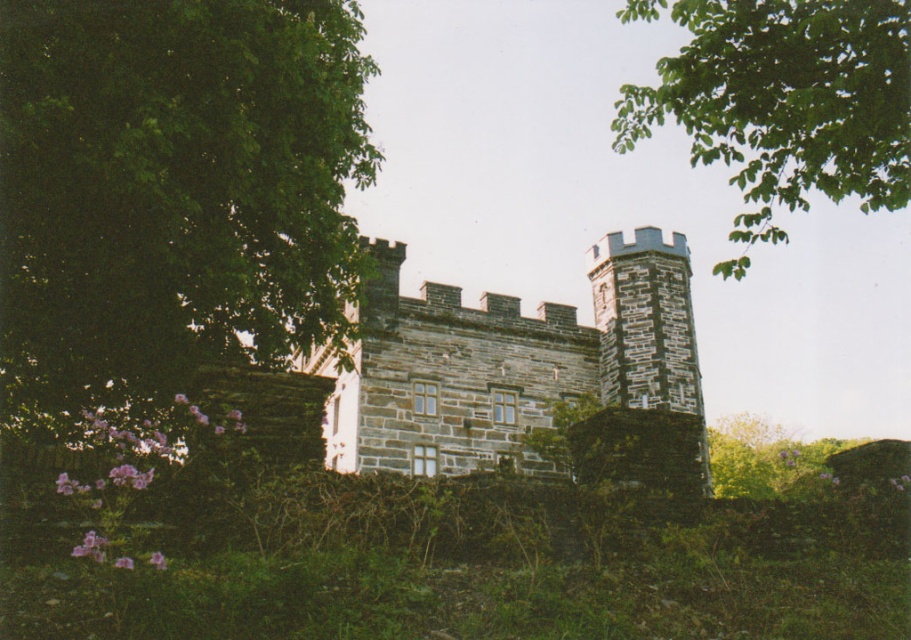
From the picture: You are standing at point (490, 340) and want to reach the castle entrance. The path is 295.28 feet long. If your walking speed is 3 feet per second, how many seconds will it take you to reach the entrance?

The path between point (490, 340) and the castle entrance is 295.28 feet long. At a walking speed of 3 feet per second, it will take 295.28 divided by 3, which is approximately 98.43 seconds to reach the entrance.

Based on the photo, you are standing in the garden of the historic stone building. You want to take a photo of the gray stone castle at center with the green leafy tree at upper right in the background. Based on their positions, will the tree appear above or below the castle in the photo?

The gray stone castle at center is located below the green leafy tree at upper right, so the tree will appear above the castle in the photo.